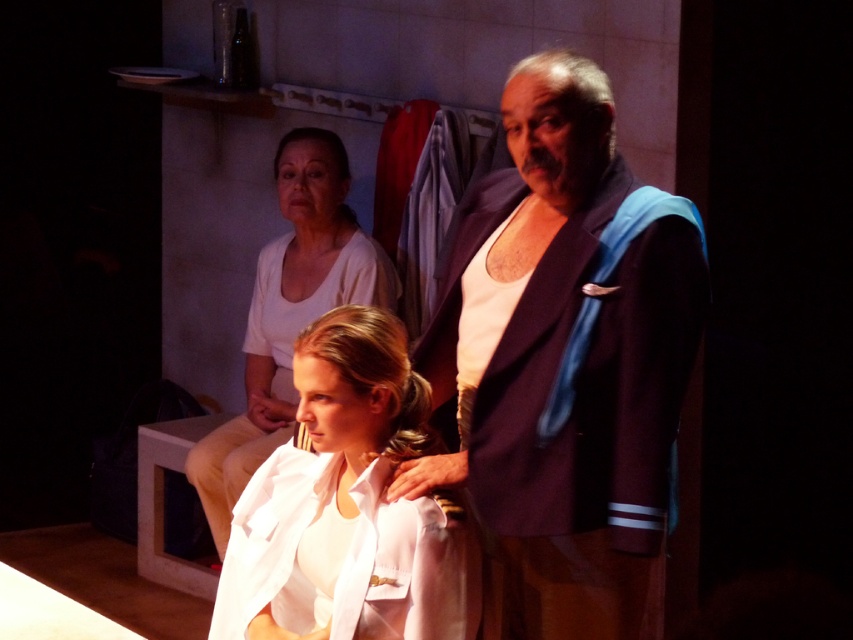
You are an interior designer assessing the color contrast in this dimly lit room. The scene includes a dark blue fabric jacket at center and a smooth white blouse at center. Which object would likely cast a stronger shadow on the floor due to its position?

The dark blue fabric jacket at center is above the smooth white blouse at center, so it would cast a stronger shadow on the floor because it is positioned higher and closer to the light source.

Based on the photo, you are a photographer positioned at the camera. You want to capture a closeup shot of the dark blue fabric jacket at center. Given that your camera can focus on objects within 5 feet, will you be able to achieve this without moving closer?

The dark blue fabric jacket at center is 7.48 feet away from the camera, which is beyond the 5 feet focus range. Therefore, you cannot capture a closeup without moving closer.

You are a photographer adjusting your camera settings in this dimly lit room. You notice two points of light at coordinates point [505,396] and point [337,604]. Which point should you focus on first to ensure the subject closest to the camera is in sharp focus?

Point [337,604] is closer to the camera than point [505,396], so you should focus on point [337,604] first to ensure the subject closest to the camera is in sharp focus.